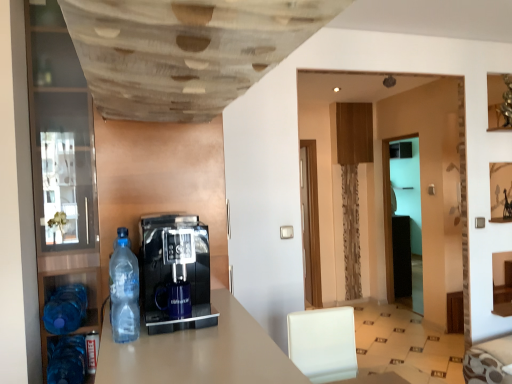
Identify the location of wooden textured ceiling at upper center. This screenshot has width=512, height=384. (184, 51).

Locate an element on the screen. The image size is (512, 384). blue plastic bottle at lower left, marked as the second bottle in a front-to-back arrangement is located at coordinates (67, 361).

In order to face blue plastic bottle at lower left, which is the 1th bottle from bottom to top, should I rotate leftwards or rightwards?

To align with it, rotate left about 24.008°.

This screenshot has width=512, height=384. What do you see at coordinates (407, 225) in the screenshot?
I see `transparent glass door at center` at bounding box center [407, 225].

Image resolution: width=512 pixels, height=384 pixels. What do you see at coordinates (61, 164) in the screenshot?
I see `transparent glass pantry at left` at bounding box center [61, 164].

Locate an element on the screen. The height and width of the screenshot is (384, 512). blue plastic bottle at lower left, positioned as the 1th bottle in back-to-front order is located at coordinates (66, 309).

Does blue plastic bottle at lower left, acting as the 2th bottle starting from the left, have a greater height compared to transparent plastic bottle at left, acting as the 1th bottle starting from the right?

Incorrect, the height of blue plastic bottle at lower left, acting as the 2th bottle starting from the left, is not larger of that of transparent plastic bottle at left, acting as the 1th bottle starting from the right.

Considering the relative sizes of blue plastic bottle at lower left, which is the 2th bottle from right to left, and transparent plastic bottle at left, marked as the 3th bottle in a bottom-to-top arrangement, in the image provided, is blue plastic bottle at lower left, which is the 2th bottle from right to left, bigger than transparent plastic bottle at left, marked as the 3th bottle in a bottom-to-top arrangement,?

Yes.

From the image's perspective, is blue plastic bottle at lower left, which is the 2th bottle from right to left, below transparent plastic bottle at left, arranged as the 1th bottle when viewed from the top?

Yes.

From a real-world perspective, between blue plastic bottle at lower left, which is the 1th bottle from bottom to top, and transparent plastic bottle at left, which is the 1th bottle in front-to-back order, who is vertically lower?

blue plastic bottle at lower left, which is the 1th bottle from bottom to top, from a real-world perspective.

Does blue plastic bottle at lower left, which is the 2th bottle from right to left, have a smaller size compared to transparent glass door at center?

Yes.

Find the location of a particular element. The height and width of the screenshot is (384, 512). glass door above the blue plastic bottle at lower left, which is the 1th bottle from bottom to top (from a real-world perspective) is located at coordinates (407, 225).

How different are the orientations of blue plastic bottle at lower left, marked as the second bottle in a front-to-back arrangement, and transparent glass door at center in degrees?

90.3 degrees separate the facing orientations of blue plastic bottle at lower left, marked as the second bottle in a front-to-back arrangement, and transparent glass door at center.

Could you measure the distance between blue plastic bottle at lower left, which appears as the 3th bottle when viewed from the top, and transparent glass door at center?

blue plastic bottle at lower left, which appears as the 3th bottle when viewed from the top, is 4.08 meters from transparent glass door at center.

Between blue plastic bottle at lower left, the 3th bottle viewed from the right, and transparent glass door at center, which one has smaller size?

blue plastic bottle at lower left, the 3th bottle viewed from the right.

Which is more to the right, blue plastic bottle at lower left, which ranks as the first bottle in left-to-right order, or transparent glass door at center?

From the viewer's perspective, transparent glass door at center appears more on the right side.

In the scene shown: Can you tell me how much blue plastic bottle at lower left, the second bottle in the top-to-bottom sequence, and transparent glass door at center differ in facing direction?

There is a 90.3-degree angle between the facing directions of blue plastic bottle at lower left, the second bottle in the top-to-bottom sequence, and transparent glass door at center.

Does transparent glass pantry at left appear on the right side of transparent plastic bottle at left, marked as the 3th bottle in a bottom-to-top arrangement?

No.

Can transparent plastic bottle at left, acting as the 1th bottle starting from the right, be found inside transparent glass pantry at left?

Actually, transparent plastic bottle at left, acting as the 1th bottle starting from the right, is outside transparent glass pantry at left.

From a real-world perspective, is transparent glass pantry at left above or below transparent plastic bottle at left, which is the 1th bottle in front-to-back order?

Result: transparent glass pantry at left is above transparent plastic bottle at left, which is the 1th bottle in front-to-back order.

From the image's perspective, is wooden textured ceiling at upper center located beneath blue plastic bottle at lower left, the 3th bottle viewed from the right?

No, from the image's perspective, wooden textured ceiling at upper center is not beneath blue plastic bottle at lower left, the 3th bottle viewed from the right.

Is wooden textured ceiling at upper center wider or thinner than blue plastic bottle at lower left, the second bottle in the top-to-bottom sequence?

Considering their sizes, wooden textured ceiling at upper center looks broader than blue plastic bottle at lower left, the second bottle in the top-to-bottom sequence.

From a real-world perspective, count 2nd bottles downward from the wooden textured ceiling at upper center and point to it. Please provide its 2D coordinates.

[(66, 309)]

Considering the sizes of objects transparent plastic bottle at left, the 3th bottle from the back, and transparent glass pantry at left in the image provided, who is bigger, transparent plastic bottle at left, the 3th bottle from the back, or transparent glass pantry at left?

With larger size is transparent glass pantry at left.

From a real-world perspective, which object rests below the other?

In real-world perspective, transparent plastic bottle at left, the 3th bottle from the back, is lower.

Considering the relative sizes of transparent plastic bottle at left, which is the 1th bottle in front-to-back order, and transparent glass pantry at left in the image provided, is transparent plastic bottle at left, which is the 1th bottle in front-to-back order, thinner than transparent glass pantry at left?

Correct, the width of transparent plastic bottle at left, which is the 1th bottle in front-to-back order, is less than that of transparent glass pantry at left.

Is there a large distance between transparent plastic bottle at left, the 3th bottle from the back, and transparent glass pantry at left?

transparent plastic bottle at left, the 3th bottle from the back, is near transparent glass pantry at left, not far away.

Consider the image. Considering the positions of objects transparent glass door at center and transparent plastic bottle at left, arranged as the 1th bottle when viewed from the top, in the image provided, who is in front, transparent glass door at center or transparent plastic bottle at left, arranged as the 1th bottle when viewed from the top,?

Positioned in front is transparent plastic bottle at left, arranged as the 1th bottle when viewed from the top.

Consider the image. Could you tell me if transparent glass door at center is turned towards transparent plastic bottle at left, the 3th bottle from the back?

No, transparent glass door at center is not aimed at transparent plastic bottle at left, the 3th bottle from the back.

Considering the positions of objects transparent glass door at center and transparent plastic bottle at left, marked as the 3th bottle in a bottom-to-top arrangement, in the image provided, who is more to the left, transparent glass door at center or transparent plastic bottle at left, marked as the 3th bottle in a bottom-to-top arrangement,?

Positioned to the left is transparent plastic bottle at left, marked as the 3th bottle in a bottom-to-top arrangement.

Locate an element on the screen. the 1st bottle counting from the left of the transparent plastic bottle at left, arranged as the 1th bottle when viewed from the top is located at coordinates (67, 361).

Where is `glass door that is behind the blue plastic bottle at lower left, marked as the second bottle in a front-to-back arrangement`? glass door that is behind the blue plastic bottle at lower left, marked as the second bottle in a front-to-back arrangement is located at coordinates (407, 225).

Considering their positions, is wooden textured ceiling at upper center positioned closer to transparent glass pantry at left than transparent plastic bottle at left, positioned as the third bottle in left-to-right order?

The object closer to transparent glass pantry at left is transparent plastic bottle at left, positioned as the third bottle in left-to-right order.

In the scene shown: Looking at the image, which one is located closer to wooden textured ceiling at upper center, transparent glass door at center or blue plastic bottle at lower left, the 3th bottle viewed from the right?

blue plastic bottle at lower left, the 3th bottle viewed from the right, is positioned closer to the anchor wooden textured ceiling at upper center.

When comparing their distances from transparent glass pantry at left, does transparent glass door at center or blue plastic bottle at lower left, acting as the 2th bottle starting from the left, seem further?

transparent glass door at center lies further to transparent glass pantry at left than the other object.

Based on their spatial positions, is transparent glass pantry at left or wooden textured ceiling at upper center closer to transparent glass door at center?

transparent glass pantry at left is positioned closer to the anchor transparent glass door at center.

Looking at the image, which one is located further to transparent glass pantry at left, blue plastic bottle at lower left, acting as the 2th bottle starting from the left, or transparent glass door at center?

transparent glass door at center lies further to transparent glass pantry at left than the other object.

Consider the image. Based on their spatial positions, is blue plastic bottle at lower left, the 2th bottle when ordered from back to front, or transparent glass door at center closer to blue plastic bottle at lower left, placed as the second bottle when sorted from bottom to top?

blue plastic bottle at lower left, the 2th bottle when ordered from back to front, is closer to blue plastic bottle at lower left, placed as the second bottle when sorted from bottom to top.

Consider the image. Looking at the image, which one is located closer to blue plastic bottle at lower left, the second bottle in the top-to-bottom sequence, transparent glass pantry at left or wooden textured ceiling at upper center?

Based on the image, transparent glass pantry at left appears to be nearer to blue plastic bottle at lower left, the second bottle in the top-to-bottom sequence.

From the image, which object appears to be nearer to blue plastic bottle at lower left, the 3th bottle viewed from the right, wooden textured ceiling at upper center or transparent glass door at center?

wooden textured ceiling at upper center is closer to blue plastic bottle at lower left, the 3th bottle viewed from the right.

Locate an element on the screen. bottle between transparent plastic bottle at left, the 3th bottle from the back, and blue plastic bottle at lower left, marked as the second bottle in a front-to-back arrangement, from top to bottom is located at coordinates (66, 309).

This screenshot has height=384, width=512. Identify the location of bottle located between blue plastic bottle at lower left, the 2th bottle when ordered from back to front, and transparent glass door at center in the depth direction. (66, 309).

The height and width of the screenshot is (384, 512). Find the location of `pantry positioned between transparent plastic bottle at left, arranged as the 1th bottle when viewed from the top, and transparent glass door at center from near to far`. pantry positioned between transparent plastic bottle at left, arranged as the 1th bottle when viewed from the top, and transparent glass door at center from near to far is located at coordinates (61, 164).

At what (x,y) coordinates should I click in order to perform the action: click on pantry between blue plastic bottle at lower left, which appears as the 3th bottle when viewed from the top, and transparent glass door at center in the front-back direction. Please return your answer as a coordinate pair (x, y). Looking at the image, I should click on (61, 164).